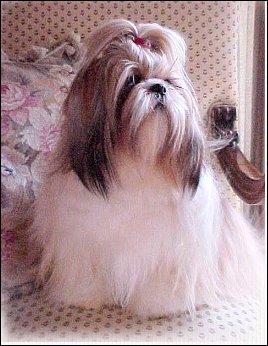
At what (x,y) coordinates should I click in order to perform the action: click on pillow. Please return your answer as a coordinate pair (x, y). The width and height of the screenshot is (268, 346). Looking at the image, I should click on (28, 143).